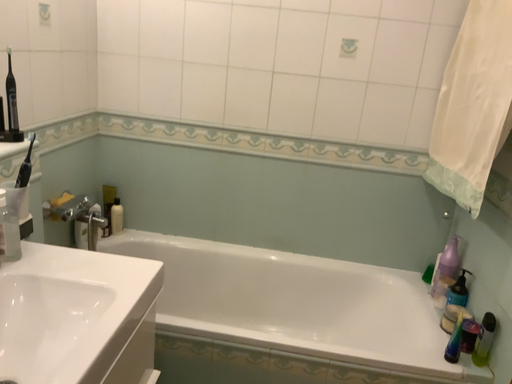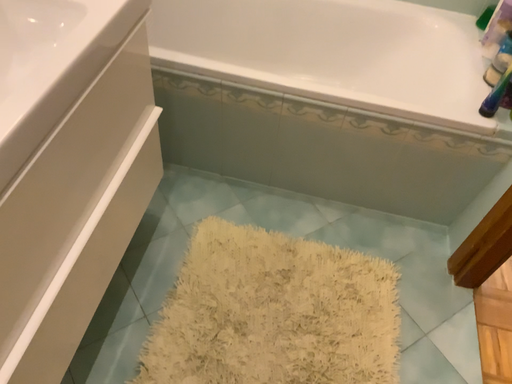
Question: How did the camera likely rotate when shooting the video?

Choices:
 (A) rotated upward
 (B) rotated downward

Answer: (B)